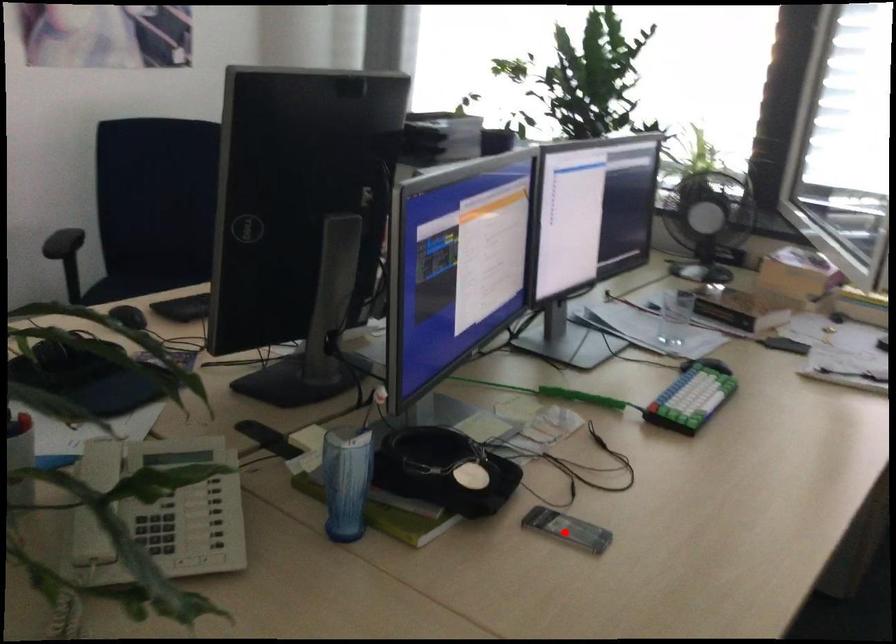
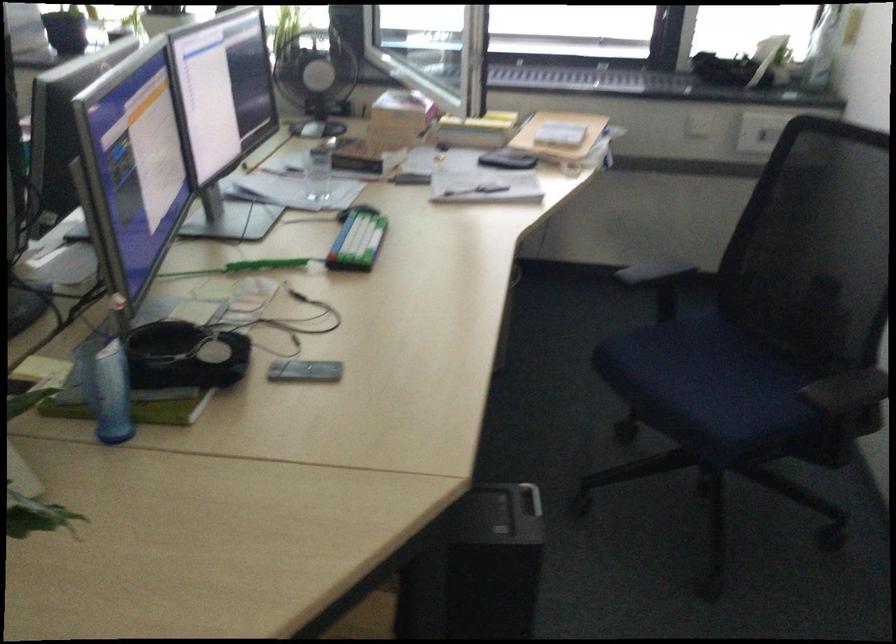
Where in the second image is the point corresponding to the highlighted location from the first image?

(305, 371)